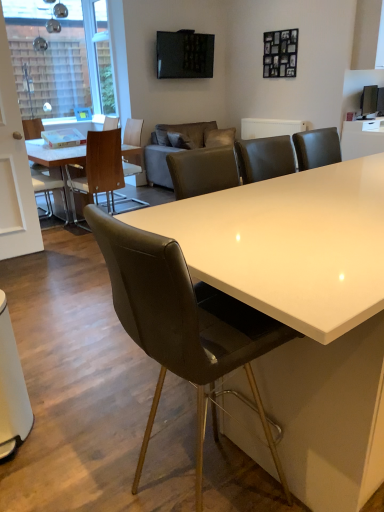
Question: Looking at their shapes, would you say wooden chair at left, the second chair viewed from the front, is wider or thinner than white glossy door at left?

Choices:
 (A) wide
 (B) thin

Answer: (A)

Question: From the image's perspective, relative to white glossy door at left, is wooden chair at left, the second chair viewed from the front, above or below?

Choices:
 (A) above
 (B) below

Answer: (B)

Question: Which object is positioned closest to the wooden chair at left, the 3th chair positioned from the back?

Choices:
 (A) white glossy door at left
 (B) matte wooden table at left, placed as the 2th table when sorted from right to left
 (C) woodenchair at left, arranged as the 1th chair when viewed from the back
 (D) leather at center, the 1th chair from the front
 (E) white leather chair at left, arranged as the 2th chair when viewed from the back

Answer: (B)

Question: Based on their relative distances, which object is nearer to the white leather chair at left, arranged as the 2th chair when viewed from the back?

Choices:
 (A) matte wooden table at left, which appears as the 1th table when viewed from the left
 (B) white glossy table at upper right, which is the second table in left-to-right order
 (C) leather at center, placed as the fourth chair when sorted from back to front
 (D) wooden chair at left, the 3th chair positioned from the back
 (E) matte gray couch at center

Answer: (A)